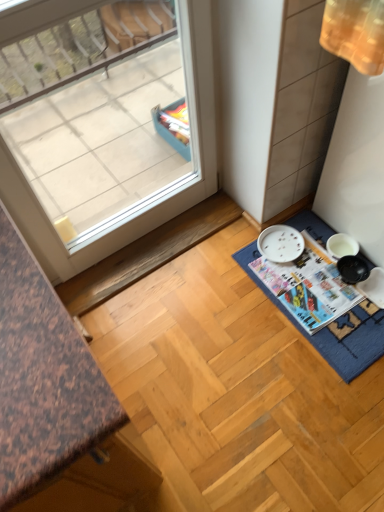
Identify the location of free space in front of white glossy magazine at lower right. (342, 339).